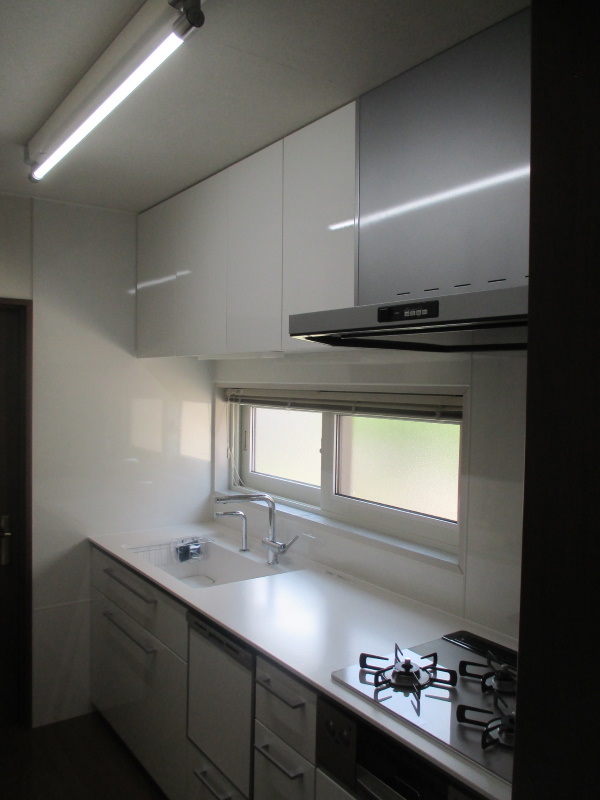
Where is `tap lever`? The width and height of the screenshot is (600, 800). tap lever is located at coordinates (302, 532).